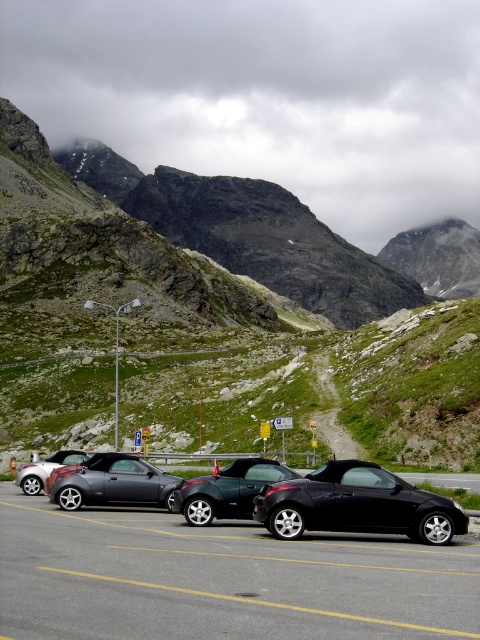
You are standing at the point marked by the coordinates point (202, 323) in the image. Which car are you closest to?

The point (202, 323) indicates metallic gray car at center, so you are closest to the metallic gray car at center.

You are a photographer standing in the parking area and want to take a photo of the metallic gray car at center and the metallic silver convertible at center. Which car should you focus on first if you want to capture both in a single shot without moving your camera?

You should focus on the metallic silver convertible at center first because it is lower in the frame than the metallic gray car at center, allowing you to adjust the camera angle to include both cars in the shot.

Looking at this image, you are a photographer wanting to capture the rugged granite mountain at upper center and the metallic silver convertible at center in the same frame. Given that the camera can only focus on objects within a 100 cm width, will both fit in the frame?

The rugged granite mountain at upper center is wider than the metallic silver convertible at center. However, the camera can only focus on objects within a 100 cm width. Since the width of the rugged granite mountain at upper center is larger than the convertible, it might exceed the camera frame. Without exact measurements, it is uncertain if both will fit.